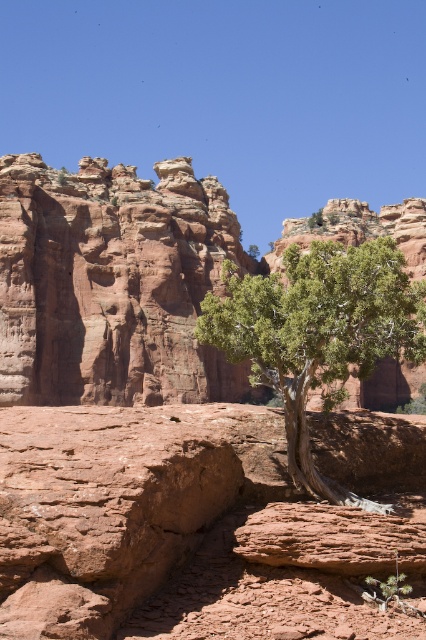
You are a hiker planning to walk from point A to point B in the landscape. Point A is at coordinate point (83, 276) and point B is at coordinate point (224, 326). Considering the terrain, which point is closer to you as you start your hike?

Point A at coordinate point (83, 276) is closer to you than point B at coordinate point (224, 326) because it is further to the viewer, meaning it is nearer in the landscape.

You are a hiker who wants to take a photo of the green leafy tree at center and the rustic sandstone rock formation at center. Since you want the tree to be in focus, which object should be closer to the camera?

The rustic sandstone rock formation at center is closer to the camera than the green leafy tree at center. To have the tree in focus, you need to adjust the camera so that the green leafy tree at center is the focal point, but since the rock formation is in front of it, you might need to position yourself so both are in the same focal plane or use a smaller aperture for deeper depth of field.

You are a hiker trying to navigate through the rugged red rock formations. You need to pass between the rustic sandstone rock formation at center and the green leafy tree at center. Based on their widths, which one do you think you should position yourself closer to in order to ensure a safe passage?

The rustic sandstone rock formation at center might be wider than the green leafy tree at center, so positioning yourself closer to the green leafy tree at center would provide a safer passage since it is narrower.